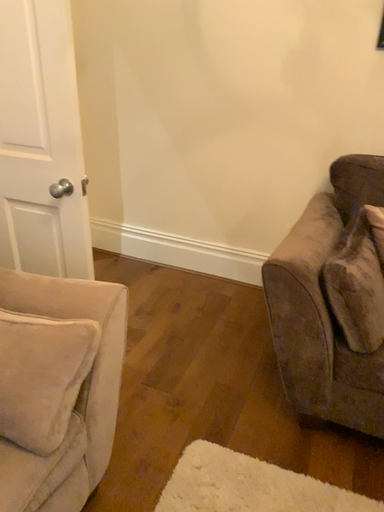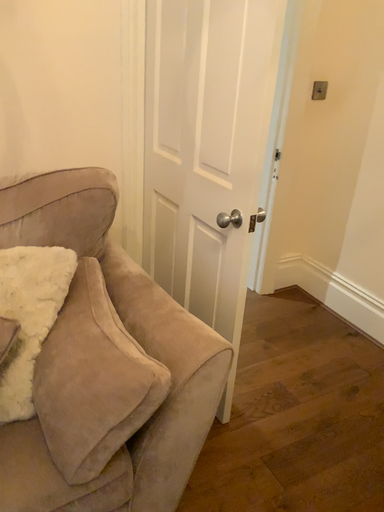
Question: How did the camera likely rotate when shooting the video?

Choices:
 (A) rotated right
 (B) rotated left

Answer: (B)